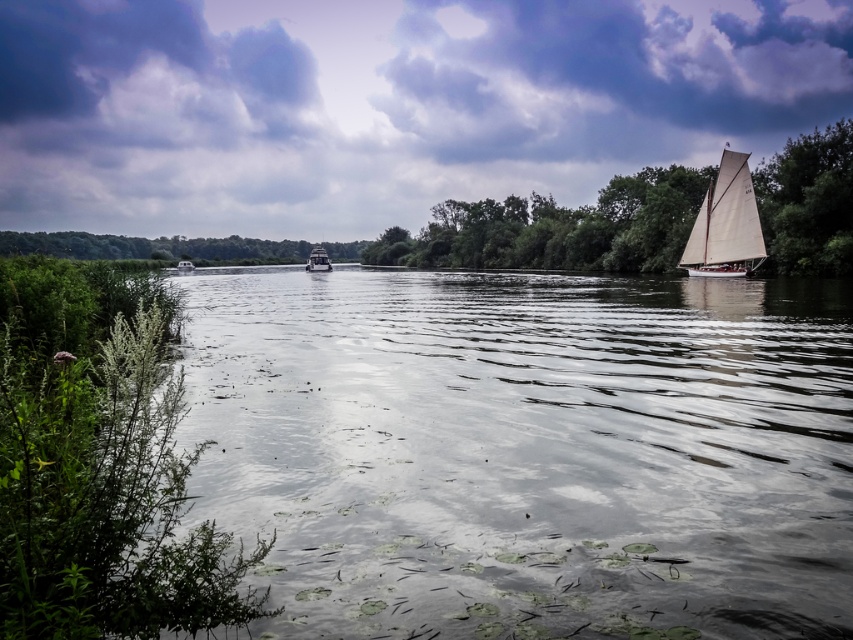
You are a boat operator who needs to navigate between the white canvas sailboat at right and the metallic gray boat at center. The safe distance required for maneuvering is 50 meters. Can you safely navigate between them?

The distance between the white canvas sailboat at right and the metallic gray boat at center is 54.14 meters, which exceeds the required 50 meters for safe navigation. Therefore, you can safely maneuver between them.

Looking at this image, you are a photographer planning to capture both the white canvas sailboat at right and the metallic gray boat at center in a single frame. Based on their sizes, which boat should you focus on to ensure both fit comfortably in the photo?

The white canvas sailboat at right has a smaller width compared to the metallic gray boat at center, so focusing on the larger metallic gray boat at center would allow both to fit comfortably in the photo.